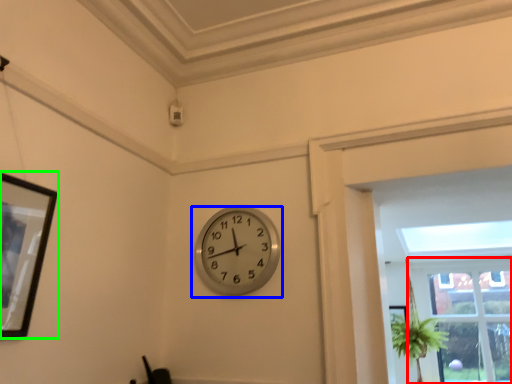
Question: Which object is positioned farthest from window (highlighted by a red box)? Select from wall clock (highlighted by a blue box) and picture frame (highlighted by a green box).

Choices:
 (A) wall clock
 (B) picture frame

Answer: (B)